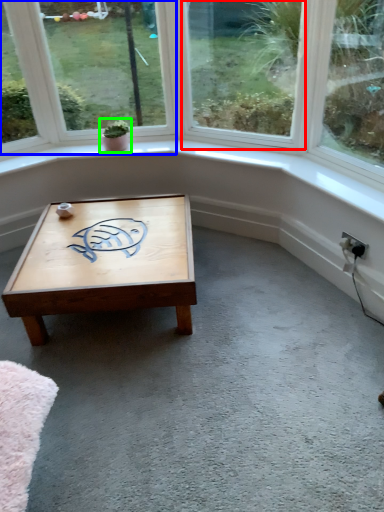
Question: Which object is positioned farthest from window (highlighted by a red box)? Select from window (highlighted by a blue box) and houseplant (highlighted by a green box).

Choices:
 (A) window
 (B) houseplant

Answer: (B)